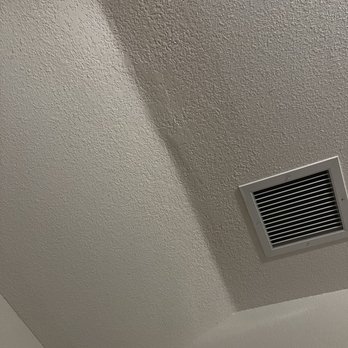
Identify the location of pointed area in ceiling. Image resolution: width=348 pixels, height=348 pixels. (233, 313).